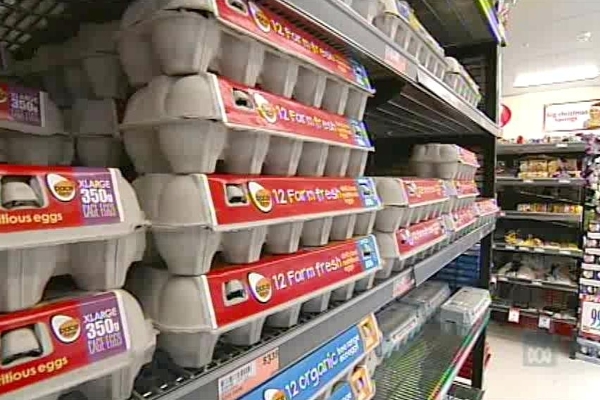
The height and width of the screenshot is (400, 600). Find the location of `cardboard egg cartons`. cardboard egg cartons is located at coordinates (104, 198), (256, 121), (425, 199), (435, 52), (461, 299).